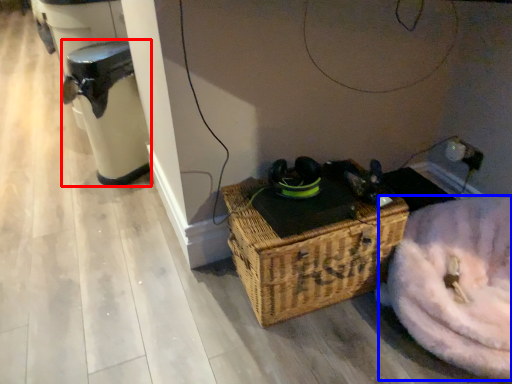
Question: Which object appears farthest to the camera in this image, water heater (highlighted by a red box) or washer (highlighted by a blue box)?

Choices:
 (A) water heater
 (B) washer

Answer: (A)